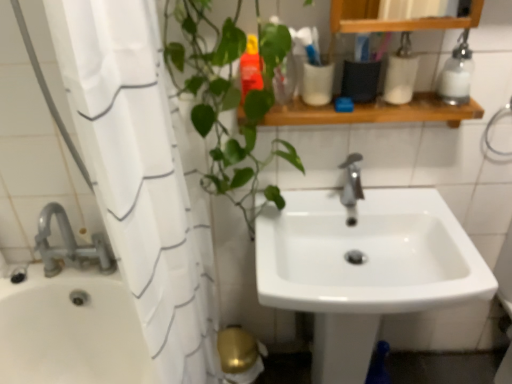
You are a GUI agent. You are given a task and a screenshot of the screen. Output one action in this format:
    pyautogui.click(x=<x>, y=<y>)
    Task: Click on the free location above wooden shelf at upper center (from a real-world perspective)
    The width and height of the screenshot is (512, 384).
    Given the screenshot: What is the action you would take?
    point(344,99)